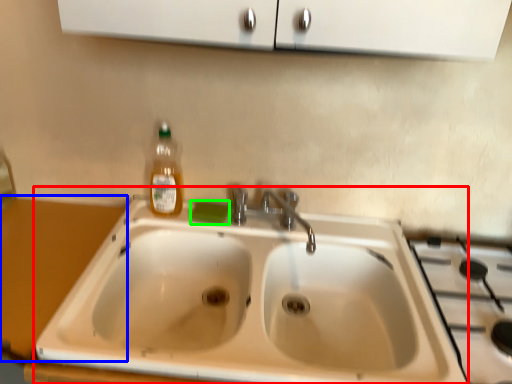
Question: Estimate the real-world distances between objects in this image. Which object is farther from sink (highlighted by a red box), counter top (highlighted by a blue box) or soap (highlighted by a green box)?

Choices:
 (A) counter top
 (B) soap

Answer: (A)